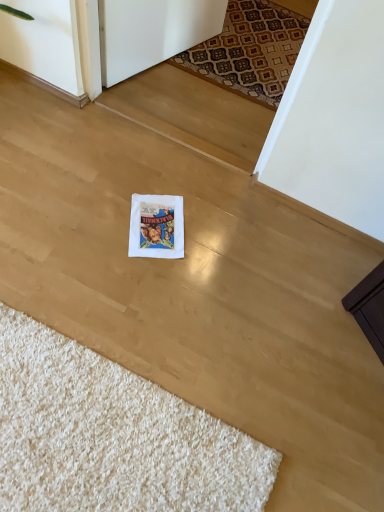
Question: Is patterned carpet at upper center positioned far away from white shaggy rug at lower left?

Choices:
 (A) yes
 (B) no

Answer: (A)

Question: From a real-world perspective, is patterned carpet at upper center located higher than white shaggy rug at lower left?

Choices:
 (A) yes
 (B) no

Answer: (B)

Question: Can you confirm if patterned carpet at upper center is positioned to the left of white shaggy rug at lower left?

Choices:
 (A) yes
 (B) no

Answer: (B)

Question: Does patterned carpet at upper center have a lesser height compared to white shaggy rug at lower left?

Choices:
 (A) no
 (B) yes

Answer: (B)

Question: Does patterned carpet at upper center contain white shaggy rug at lower left?

Choices:
 (A) yes
 (B) no

Answer: (B)

Question: Considering the relative sizes of patterned carpet at upper center and white shaggy rug at lower left in the image provided, is patterned carpet at upper center wider than white shaggy rug at lower left?

Choices:
 (A) yes
 (B) no

Answer: (B)

Question: Would you say white shaggy rug at lower left is outside patterned carpet at upper center?

Choices:
 (A) no
 (B) yes

Answer: (B)

Question: Is white shaggy rug at lower left turned away from patterned carpet at upper center?

Choices:
 (A) no
 (B) yes

Answer: (A)

Question: Is white shaggy rug at lower left shorter than patterned carpet at upper center?

Choices:
 (A) yes
 (B) no

Answer: (B)

Question: From the image's perspective, is white shaggy rug at lower left located beneath patterned carpet at upper center?

Choices:
 (A) yes
 (B) no

Answer: (A)

Question: From a real-world perspective, is white shaggy rug at lower left beneath patterned carpet at upper center?

Choices:
 (A) yes
 (B) no

Answer: (B)

Question: Is white shaggy rug at lower left positioned in front of patterned carpet at upper center?

Choices:
 (A) yes
 (B) no

Answer: (A)

Question: Considering the relative positions of patterned carpet at upper center and white paper postcard at center in the image provided, is patterned carpet at upper center in front of white paper postcard at center?

Choices:
 (A) no
 (B) yes

Answer: (A)